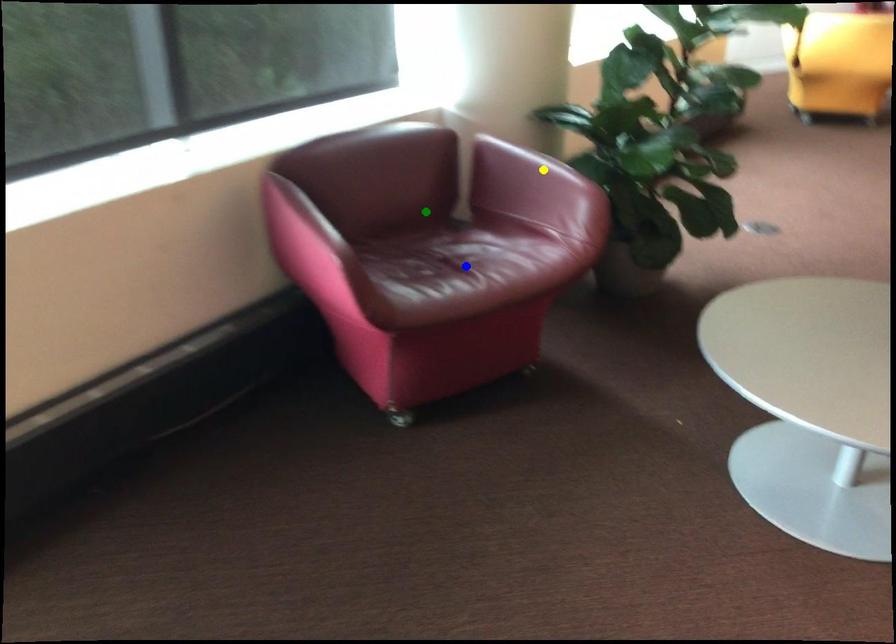
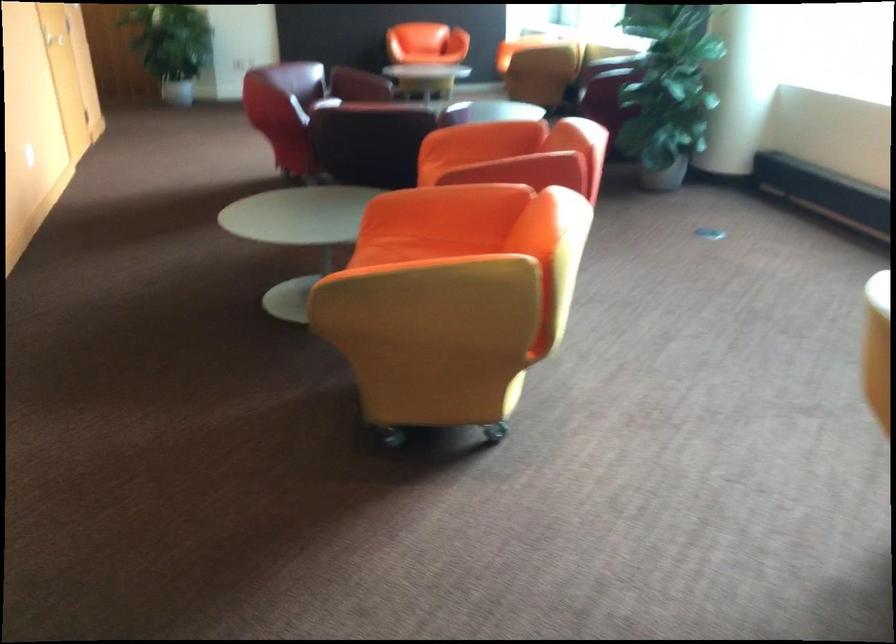
I am providing you with two images of the same scene from different viewpoints. Three points are marked in image1. Which point corresponds to a part or object that is occluded in image2?In image1, three points are marked. Which of them correspond to a part or object that is occluded in image2?Among the three points shown in image1, which one corresponds to a part or object that is no longer visible due to occlusion in image2?

yellow point, blue point, green point